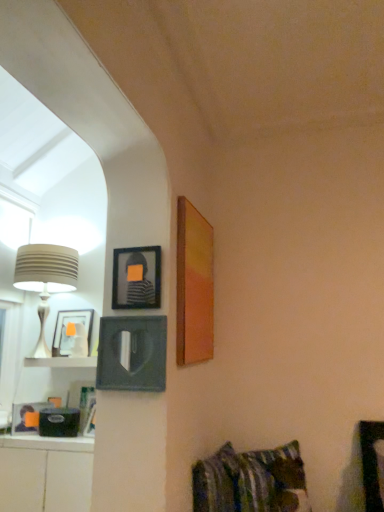
Locate an element on the screen. Image resolution: width=384 pixels, height=512 pixels. free space above white glossy cabinet at lower left (from a real-world perspective) is located at coordinates (41, 435).